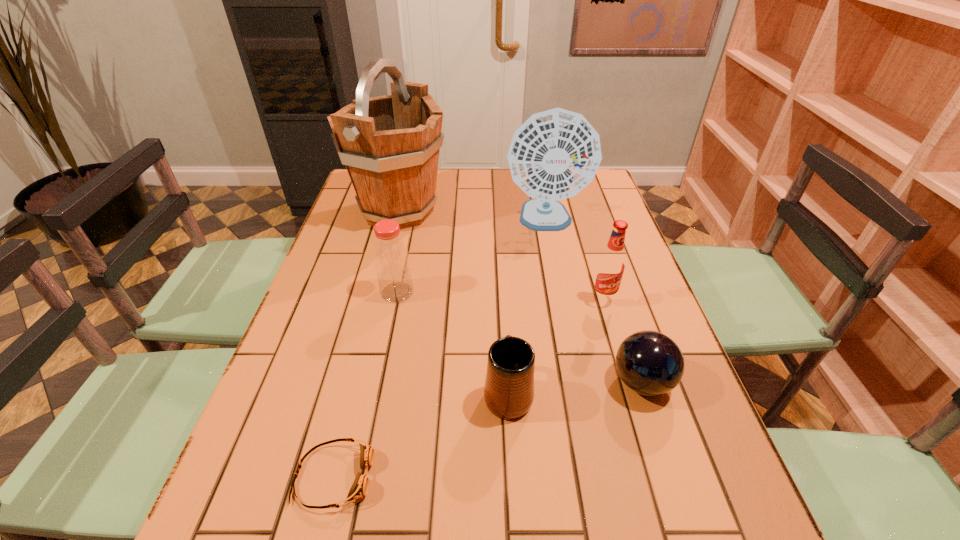
What are the coordinates of `free region located on the back of the root beer` in the screenshot? It's located at (587, 246).

Identify the location of vacant space located on the back of the bottle. The image size is (960, 540). (404, 260).

At what (x,y) coordinates should I click in order to perform the action: click on vacant area situated 0.140m on the side of the mug with the handle. Please return your answer as a coordinate pair (x, y). Looking at the image, I should click on (x=504, y=321).

Identify the location of vacant space situated 0.170m on the side of the mug with the handle. Image resolution: width=960 pixels, height=540 pixels. (503, 312).

What are the coordinates of `vacant space located on the side of the mug with the handle` in the screenshot? It's located at (505, 339).

Where is `vacant space situated 0.100m on the side of the bowling ball with the finger holes`? This screenshot has width=960, height=540. vacant space situated 0.100m on the side of the bowling ball with the finger holes is located at coordinates (564, 382).

This screenshot has height=540, width=960. What are the coordinates of `free point located on the side of the bowling ball with the finger holes` in the screenshot? It's located at (546, 382).

Find the location of a particular element. The width and height of the screenshot is (960, 540). free space located 0.190m on the side of the bowling ball with the finger holes is located at coordinates (523, 382).

Locate an element on the screen. vacant space located with the lenses facing forward on the goggles is located at coordinates (560, 476).

Identify the location of bucket situated at the far edge. The image size is (960, 540). (390, 144).